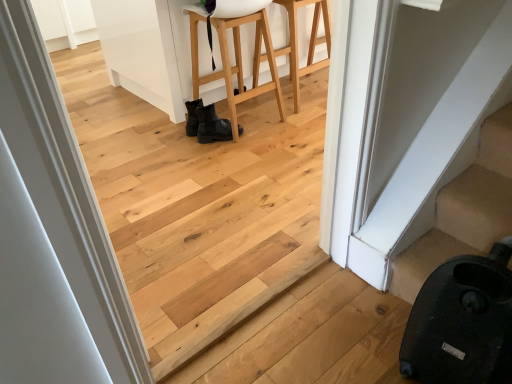
The width and height of the screenshot is (512, 384). Describe the element at coordinates (309, 42) in the screenshot. I see `natural wood stool at center, the first furniture viewed from the right` at that location.

At what (x,y) coordinates should I click in order to perform the action: click on white smooth door at left. Please return your answer as a coordinate pair (x, y). Looking at the image, I should click on (53, 235).

I want to click on black leather boots at center, the 1th furniture when ordered from left to right, so click(x=237, y=61).

Where is `natural wood stool at center, acting as the 2th furniture starting from the left`? This screenshot has width=512, height=384. natural wood stool at center, acting as the 2th furniture starting from the left is located at coordinates (309, 42).

Considering the sizes of natural wood stool at center, the first furniture viewed from the right, and black matte boots at center in the image, is natural wood stool at center, the first furniture viewed from the right, taller or shorter than black matte boots at center?

Clearly, natural wood stool at center, the first furniture viewed from the right, is taller compared to black matte boots at center.

From the image's perspective, is natural wood stool at center, the first furniture viewed from the right, below black matte boots at center?

No.

Is natural wood stool at center, acting as the 2th furniture starting from the left, not within black matte boots at center?

natural wood stool at center, acting as the 2th furniture starting from the left, lies outside black matte boots at center's area.

Relative to black matte boots at center, is natural wood stool at center, the first furniture viewed from the right, in front or behind?

Visually, natural wood stool at center, the first furniture viewed from the right, is located in front of black matte boots at center.

Does white smooth door at left have a lesser height compared to natural wood stool at center, acting as the 2th furniture starting from the left?

No.

Can we say white smooth door at left lies outside natural wood stool at center, the first furniture viewed from the right?

Yes, white smooth door at left is outside of natural wood stool at center, the first furniture viewed from the right.

In the scene shown: Considering the positions of objects white smooth door at left and natural wood stool at center, the first furniture viewed from the right, in the image provided, who is in front, white smooth door at left or natural wood stool at center, the first furniture viewed from the right,?

Positioned in front is white smooth door at left.

Who is bigger, natural wood stool at center, the first furniture viewed from the right, or black leather boots at center, the 2th furniture viewed from the right?

Bigger between the two is black leather boots at center, the 2th furniture viewed from the right.

Does natural wood stool at center, the first furniture viewed from the right, have a greater width compared to black leather boots at center, the 1th furniture when ordered from left to right?

In fact, natural wood stool at center, the first furniture viewed from the right, might be narrower than black leather boots at center, the 1th furniture when ordered from left to right.

Is natural wood stool at center, the first furniture viewed from the right, positioned in front of black leather boots at center, the 2th furniture viewed from the right?

No.

Is white smooth door at left directly adjacent to black leather boots at center, the 1th furniture when ordered from left to right?

No, white smooth door at left is not making contact with black leather boots at center, the 1th furniture when ordered from left to right.

Can you confirm if white smooth door at left is wider than black leather boots at center, the 1th furniture when ordered from left to right?

Incorrect, the width of white smooth door at left does not surpass that of black leather boots at center, the 1th furniture when ordered from left to right.

Is white smooth door at left oriented away from black leather boots at center, the 1th furniture when ordered from left to right?

No, black leather boots at center, the 1th furniture when ordered from left to right, is not at the back of white smooth door at left.

Considering the relative positions of white smooth door at left and black leather boots at center, the 1th furniture when ordered from left to right, in the image provided, is white smooth door at left behind black leather boots at center, the 1th furniture when ordered from left to right,?

No, it is in front of black leather boots at center, the 1th furniture when ordered from left to right.

Which of these two, natural wood stool at center, the first furniture viewed from the right, or white smooth door at left, is bigger?

→ natural wood stool at center, the first furniture viewed from the right.

Would you consider natural wood stool at center, the first furniture viewed from the right, to be distant from white smooth door at left?

Yes.

Between natural wood stool at center, acting as the 2th furniture starting from the left, and white smooth door at left, which one appears on the left side from the viewer's perspective?

Positioned to the left is white smooth door at left.

Is natural wood stool at center, acting as the 2th furniture starting from the left, outside of white smooth door at left?

That's correct, natural wood stool at center, acting as the 2th furniture starting from the left, is outside of white smooth door at left.

Visually, is black matte boots at center positioned to the left or to the right of white smooth door at left?

Clearly, black matte boots at center is on the right of white smooth door at left in the image.

Does black matte boots at center touch white smooth door at left?

black matte boots at center and white smooth door at left are not in contact.

Considering the sizes of black matte boots at center and white smooth door at left in the image, is black matte boots at center wider or thinner than white smooth door at left?

black matte boots at center is wider than white smooth door at left.

Considering the positions of points (33, 200) and (200, 118), is point (33, 200) closer to camera compared to point (200, 118)?

Yes, point (33, 200) is in front of point (200, 118).

Looking at this image, does white smooth door at left appear on the right side of black matte boots at center?

No.

Which of these two, white smooth door at left or black matte boots at center, is wider?

Wider between the two is black matte boots at center.

Is white smooth door at left oriented towards black matte boots at center?

No, white smooth door at left is not turned towards black matte boots at center.

Identify the location of furniture that is the 1st object above the black matte boots at center (from a real-world perspective). The height and width of the screenshot is (384, 512). (309, 42).

Where is `door located below the natural wood stool at center, the first furniture viewed from the right (from the image's perspective)`? This screenshot has width=512, height=384. door located below the natural wood stool at center, the first furniture viewed from the right (from the image's perspective) is located at coordinates (53, 235).

When comparing their distances from natural wood stool at center, acting as the 2th furniture starting from the left, does white smooth door at left or black matte boots at center seem further?

white smooth door at left.

When comparing their distances from black matte boots at center, does black leather boots at center, the 2th furniture viewed from the right, or natural wood stool at center, acting as the 2th furniture starting from the left, seem closer?

Among the two, black leather boots at center, the 2th furniture viewed from the right, is located nearer to black matte boots at center.

From the image, which object appears to be farther from black leather boots at center, the 2th furniture viewed from the right, natural wood stool at center, the first furniture viewed from the right, or black matte boots at center?

black matte boots at center is further to black leather boots at center, the 2th furniture viewed from the right.

Considering their positions, is black leather boots at center, the 2th furniture viewed from the right, positioned further to white smooth door at left than natural wood stool at center, acting as the 2th furniture starting from the left?

natural wood stool at center, acting as the 2th furniture starting from the left, is further to white smooth door at left.

Estimate the real-world distances between objects in this image. Which object is closer to white smooth door at left, black matte boots at center or natural wood stool at center, the first furniture viewed from the right?

black matte boots at center is positioned closer to the anchor white smooth door at left.

Based on their spatial positions, is natural wood stool at center, acting as the 2th furniture starting from the left, or black matte boots at center closer to white smooth door at left?

black matte boots at center.

Estimate the real-world distances between objects in this image. Which object is closer to black leather boots at center, the 2th furniture viewed from the right, white smooth door at left or black matte boots at center?

black matte boots at center.

Considering their positions, is black matte boots at center positioned closer to natural wood stool at center, acting as the 2th furniture starting from the left, than white smooth door at left?

black matte boots at center.

Locate an element on the screen. This screenshot has width=512, height=384. furniture located between white smooth door at left and natural wood stool at center, acting as the 2th furniture starting from the left, in the depth direction is located at coordinates (237, 61).

The width and height of the screenshot is (512, 384). Find the location of `furniture between natural wood stool at center, acting as the 2th furniture starting from the left, and black matte boots at center in the up-down direction`. furniture between natural wood stool at center, acting as the 2th furniture starting from the left, and black matte boots at center in the up-down direction is located at coordinates (237, 61).